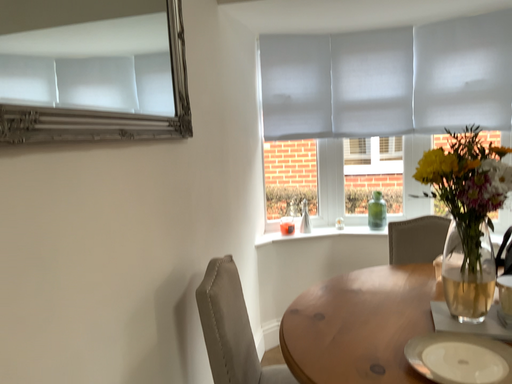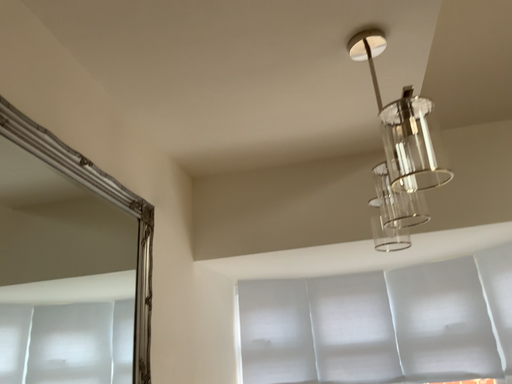
Question: Which way did the camera rotate in the video?

Choices:
 (A) rotated downward
 (B) rotated upward

Answer: (B)